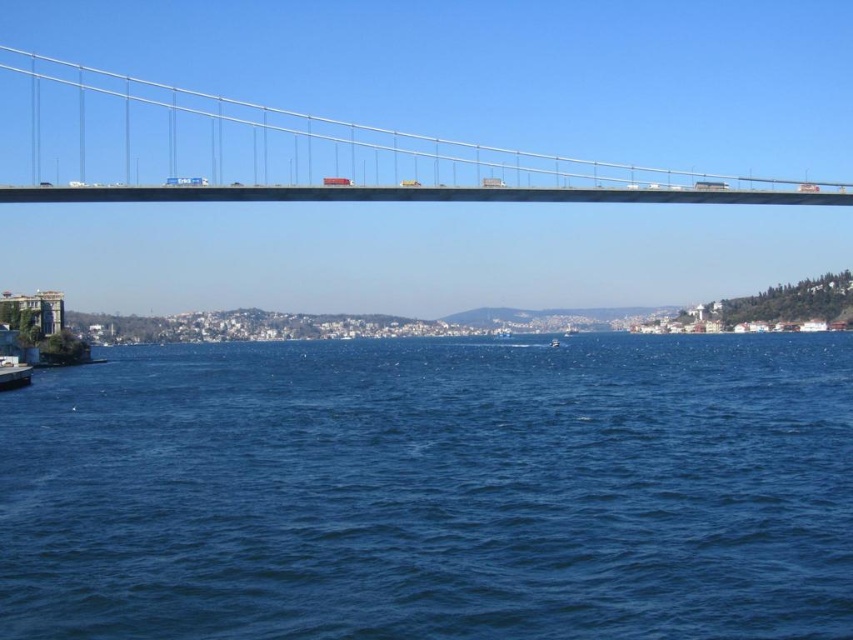
Looking at this image, who is positioned more to the right, blue water at center or metallic gray suspension bridge at upper center?

Positioned to the right is metallic gray suspension bridge at upper center.

Is blue water at center to the left of metallic gray suspension bridge at upper center from the viewer's perspective?

Yes, blue water at center is to the left of metallic gray suspension bridge at upper center.

The image size is (853, 640). I want to click on blue water at center, so click(x=433, y=492).